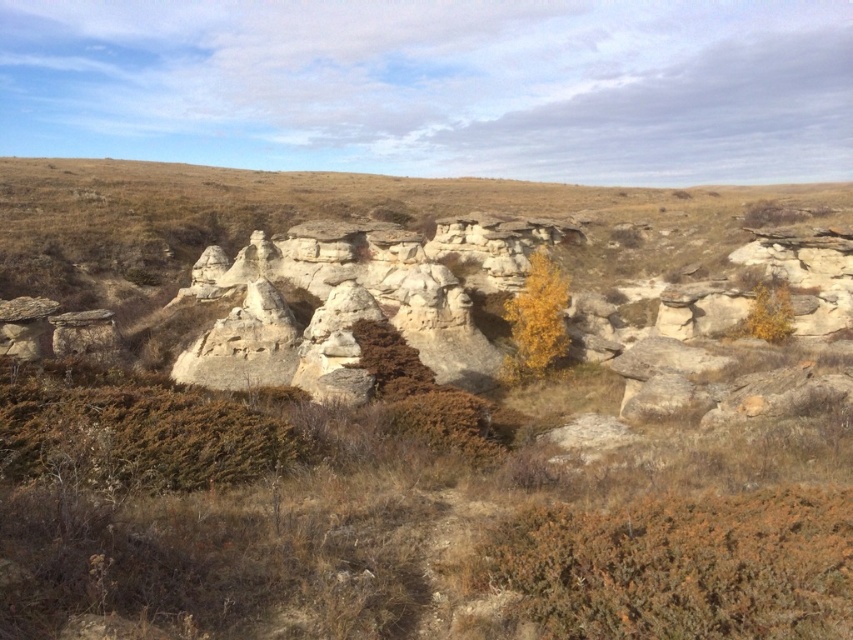
Question: Is yellow leafy tree at center closer to camera compared to yellow leafy tree at center-right?

Choices:
 (A) no
 (B) yes

Answer: (B)

Question: Which object is positioned closest to the white sandstone rock formation at center?

Choices:
 (A) yellow leafy tree at center-right
 (B) yellow leafy tree at center

Answer: (B)

Question: Is yellow leafy tree at center in front of yellow leafy tree at center-right?

Choices:
 (A) yes
 (B) no

Answer: (A)

Question: Among these objects, which one is nearest to the camera?

Choices:
 (A) white sandstone rock formation at center
 (B) yellow leafy tree at center-right
 (C) yellow leafy tree at center

Answer: (A)

Question: Estimate the real-world distances between objects in this image. Which object is farther from the white sandstone rock formation at center?

Choices:
 (A) yellow leafy tree at center
 (B) yellow leafy tree at center-right

Answer: (B)

Question: Observing the image, what is the correct spatial positioning of white sandstone rock formation at center in reference to yellow leafy tree at center-right?

Choices:
 (A) below
 (B) above

Answer: (B)